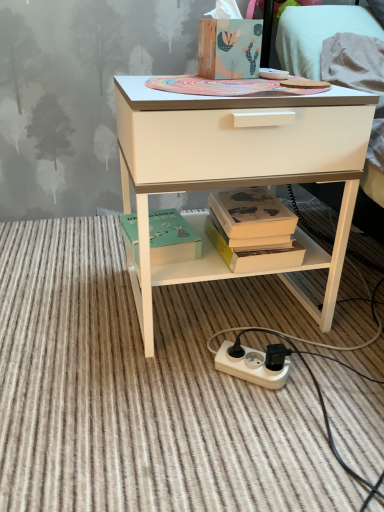
Question: Is green matte box at lower center, the 2th box viewed from the top, bigger or smaller than white plastic power strip at lower center?

Choices:
 (A) small
 (B) big

Answer: (A)

Question: Considering the positions of green matte box at lower center, the 2th box viewed from the top, and white plastic power strip at lower center in the image, is green matte box at lower center, the 2th box viewed from the top, taller or shorter than white plastic power strip at lower center?

Choices:
 (A) tall
 (B) short

Answer: (A)

Question: Which object is positioned closest to the white plastic power outlet at lower center?

Choices:
 (A) wooden tissue box at upper center, positioned as the first box in right-to-left order
 (B) hardcover book at center
 (C) white matte desk at center
 (D) green matte box at lower center, marked as the first box in a bottom-to-top arrangement
 (E) white plastic power strip at lower center

Answer: (E)

Question: Estimate the real-world distances between objects in this image. Which object is farther from the white plastic power outlet at lower center?

Choices:
 (A) white plastic power strip at lower center
 (B) wooden tissue box at upper center, placed as the 2th box when sorted from left to right
 (C) hardcover book at center
 (D) green matte box at lower center, marked as the first box in a bottom-to-top arrangement
 (E) white matte desk at center

Answer: (B)